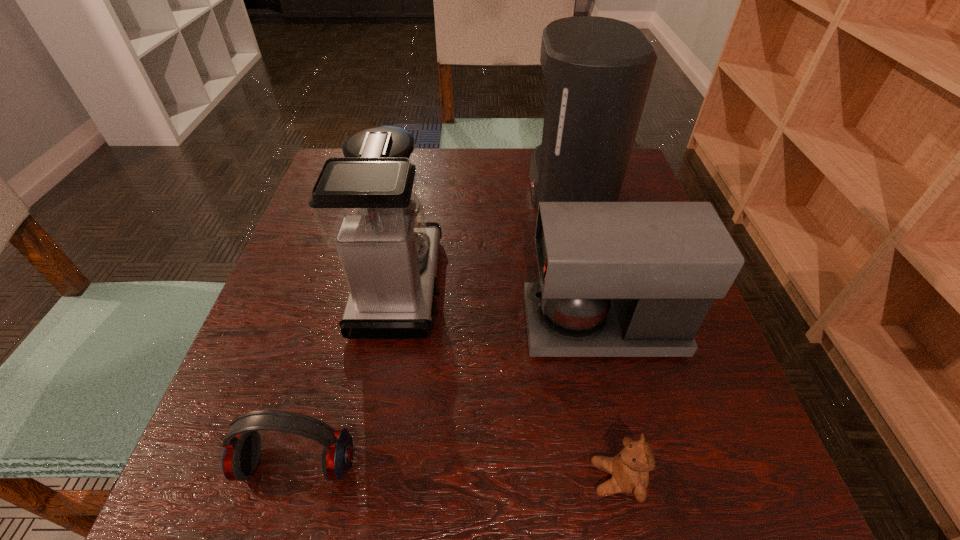
You are a GUI agent. You are given a task and a screenshot of the screen. Output one action in this format:
    pyautogui.click(x=<x>, y=<y>)
    Task: Click on the free space between the shortest object and the leftmost coffee maker
    
    Given the screenshot: What is the action you would take?
    pyautogui.click(x=508, y=382)

Locate an element on the screen. vacant space that's between the fourth shortest object and the teddy bear is located at coordinates (508, 382).

Identify the location of free space between the earphone and the farthest coffee maker. The image size is (960, 540). (433, 326).

I want to click on vacant area between the leftmost coffee maker and the shortest object, so click(x=508, y=382).

Identify the location of free space between the second shortest object and the leftmost coffee maker. (348, 375).

Identify which object is located as the fourth nearest to the fourth shortest object. Please provide its 2D coordinates. Your answer should be formatted as a tuple, i.e. [(x, y)], where the tuple contains the x and y coordinates of a point satisfying the conditions above.

[(630, 468)]

Where is `object that is the closest to the second shortest object`? This screenshot has width=960, height=540. object that is the closest to the second shortest object is located at coordinates (366, 205).

Identify which coffee maker is the second closest to the second shortest object. Please provide its 2D coordinates. Your answer should be formatted as a tuple, i.e. [(x, y)], where the tuple contains the x and y coordinates of a point satisfying the conditions above.

[(617, 279)]

The height and width of the screenshot is (540, 960). I want to click on the second closest coffee maker to the earphone, so click(x=617, y=279).

Where is `vacant space that satisfies the following two spatial constraints: 1. on the carafe side of the third tallest object; 2. on the ear cups of the fourth tallest object`? vacant space that satisfies the following two spatial constraints: 1. on the carafe side of the third tallest object; 2. on the ear cups of the fourth tallest object is located at coordinates [636, 464].